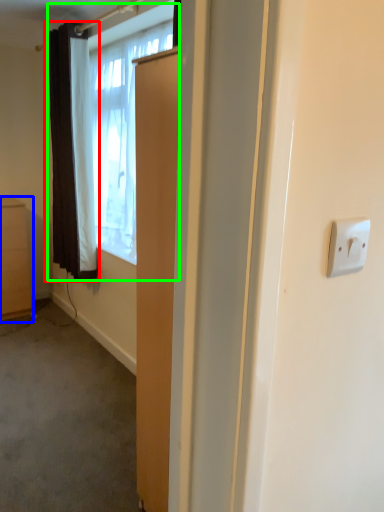
Question: Estimate the real-world distances between objects in this image. Which object is farther from curtain (highlighted by a red box), cabinetry (highlighted by a blue box) or window (highlighted by a green box)?

Choices:
 (A) cabinetry
 (B) window

Answer: (A)